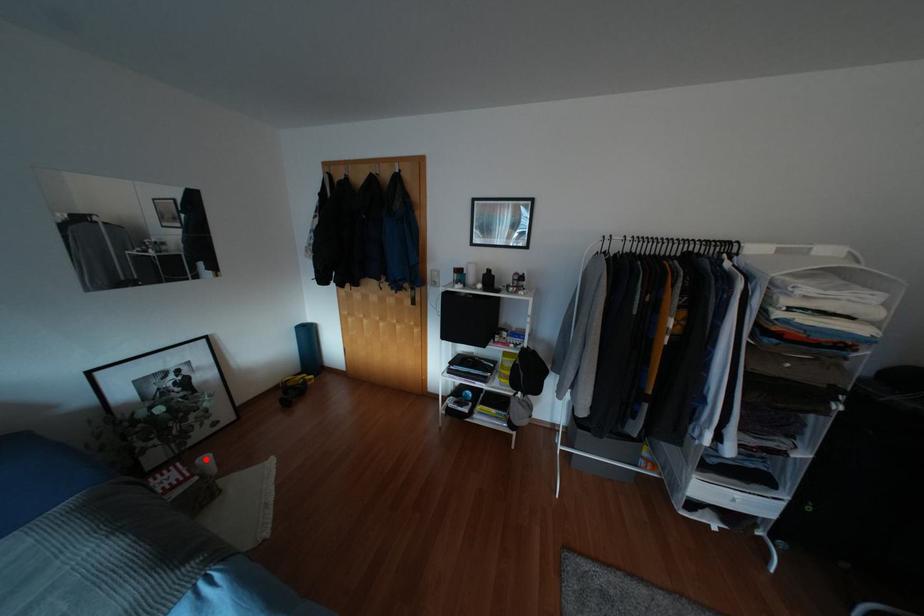
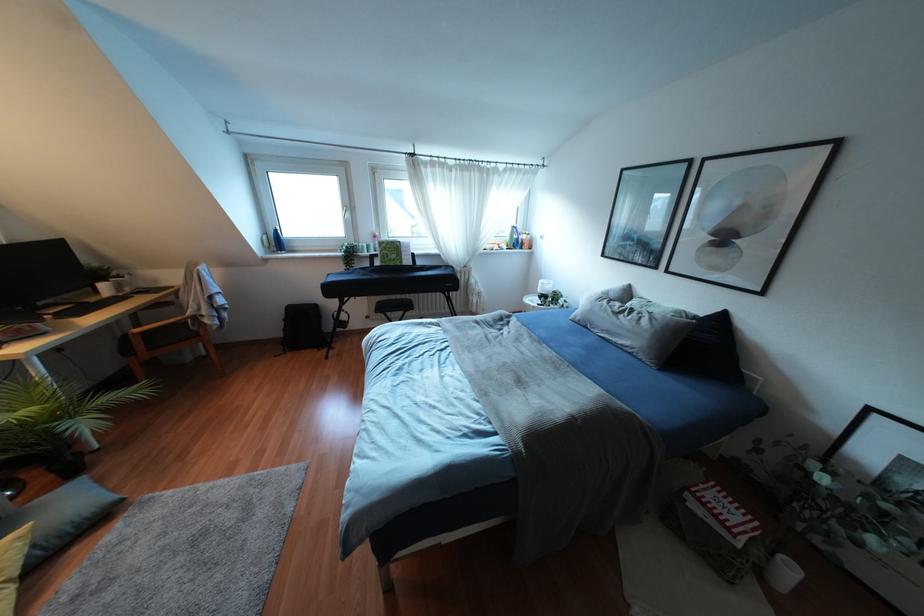
The point at the highlighted location is marked in the first image. Where is the corresponding point in the second image?

(791, 570)